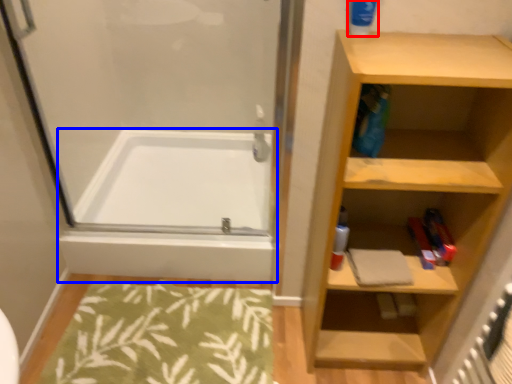
Question: Which object appears closest to the camera in this image, cleaning product (highlighted by a red box) or bathtub (highlighted by a blue box)?

Choices:
 (A) cleaning product
 (B) bathtub

Answer: (A)